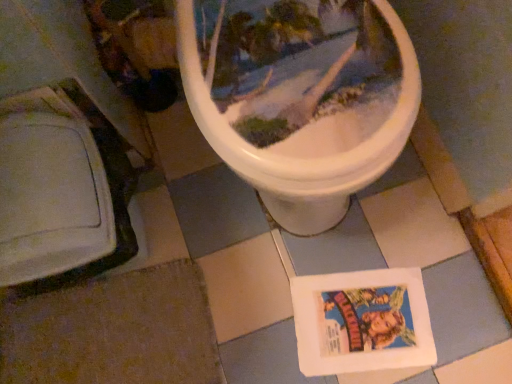
Locate an element on the screen. The image size is (512, 384). free space between white paper comic book at lower center and brown fabric at lower left is located at coordinates pyautogui.click(x=265, y=308).